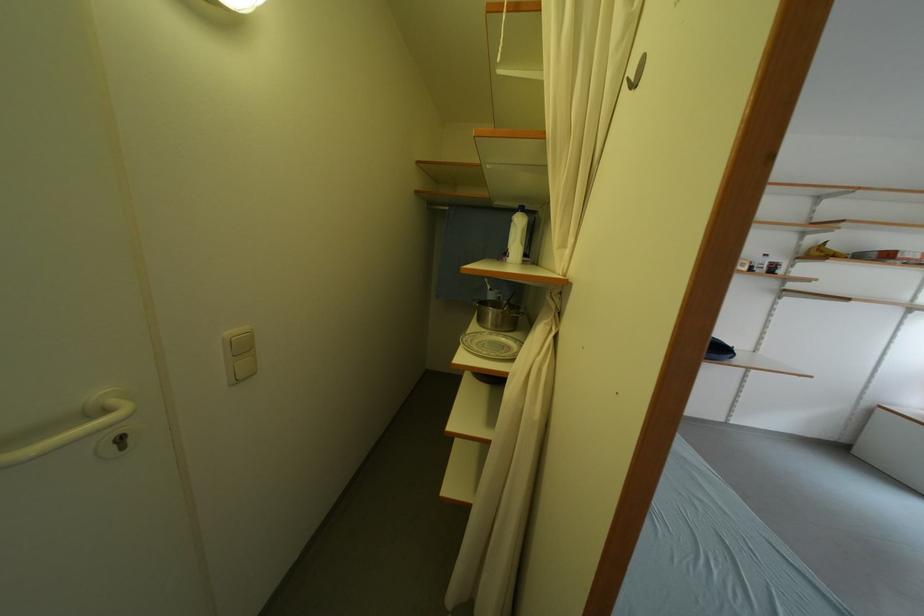
Locate an element on the screen. The height and width of the screenshot is (616, 924). door lock keyhole is located at coordinates (120, 440).